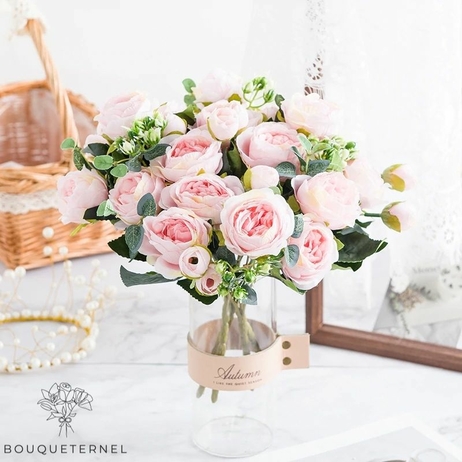
Find the location of `wicker basket`. wicker basket is located at coordinates (22, 231), (94, 236), (32, 171).